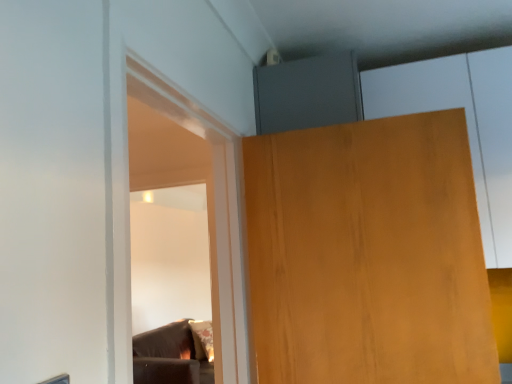
Question: Considering the relative sizes of matte wood cabinet at upper right and wooden door at upper right in the image provided, is matte wood cabinet at upper right taller than wooden door at upper right?

Choices:
 (A) no
 (B) yes

Answer: (B)

Question: Considering the relative sizes of matte wood cabinet at upper right and wooden door at upper right in the image provided, is matte wood cabinet at upper right thinner than wooden door at upper right?

Choices:
 (A) no
 (B) yes

Answer: (A)

Question: Is matte wood cabinet at upper right closer to camera compared to wooden door at upper right?

Choices:
 (A) yes
 (B) no

Answer: (B)

Question: Is matte wood cabinet at upper right not inside wooden door at upper right?

Choices:
 (A) yes
 (B) no

Answer: (A)

Question: Considering the relative positions of matte wood cabinet at upper right and wooden door at upper right in the image provided, is matte wood cabinet at upper right to the right of wooden door at upper right from the viewer's perspective?

Choices:
 (A) no
 (B) yes

Answer: (B)

Question: From the image's perspective, would you say matte wood cabinet at upper right is shown under wooden door at upper right?

Choices:
 (A) no
 (B) yes

Answer: (A)

Question: Could you tell me if wooden door at upper right is turned towards matte wood cabinet at upper right?

Choices:
 (A) no
 (B) yes

Answer: (A)

Question: Can you confirm if wooden door at upper right is taller than matte wood cabinet at upper right?

Choices:
 (A) yes
 (B) no

Answer: (B)

Question: Does wooden door at upper right appear on the right side of matte wood cabinet at upper right?

Choices:
 (A) yes
 (B) no

Answer: (B)

Question: Is wooden door at upper right completely or partially outside of matte wood cabinet at upper right?

Choices:
 (A) no
 (B) yes

Answer: (B)

Question: Is wooden door at upper right oriented away from matte wood cabinet at upper right?

Choices:
 (A) no
 (B) yes

Answer: (B)

Question: Are wooden door at upper right and matte wood cabinet at upper right beside each other?

Choices:
 (A) yes
 (B) no

Answer: (B)

Question: Is point (288, 271) positioned closer to the camera than point (498, 238)?

Choices:
 (A) closer
 (B) farther

Answer: (A)